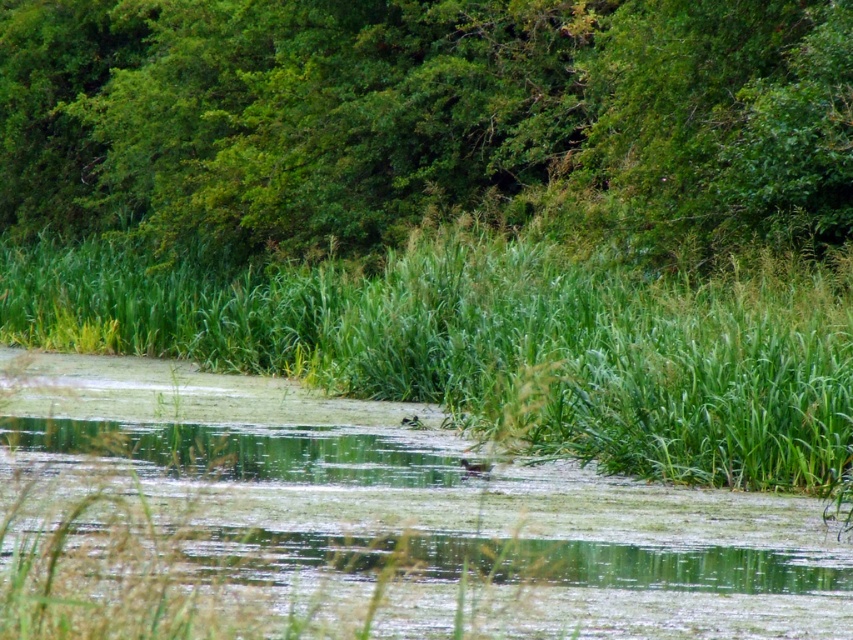
Question: Is green leafy trees at upper center smaller than green grass at center?

Choices:
 (A) yes
 (B) no

Answer: (B)

Question: Which object appears farthest from the camera in this image?

Choices:
 (A) green grass at center
 (B) green leafy trees at upper center

Answer: (B)

Question: Which object is farther from the camera taking this photo?

Choices:
 (A) green leafy trees at upper center
 (B) green grass at center

Answer: (A)

Question: Is green leafy trees at upper center behind green grass at center?

Choices:
 (A) yes
 (B) no

Answer: (A)

Question: Is green leafy trees at upper center smaller than green grass at center?

Choices:
 (A) no
 (B) yes

Answer: (A)